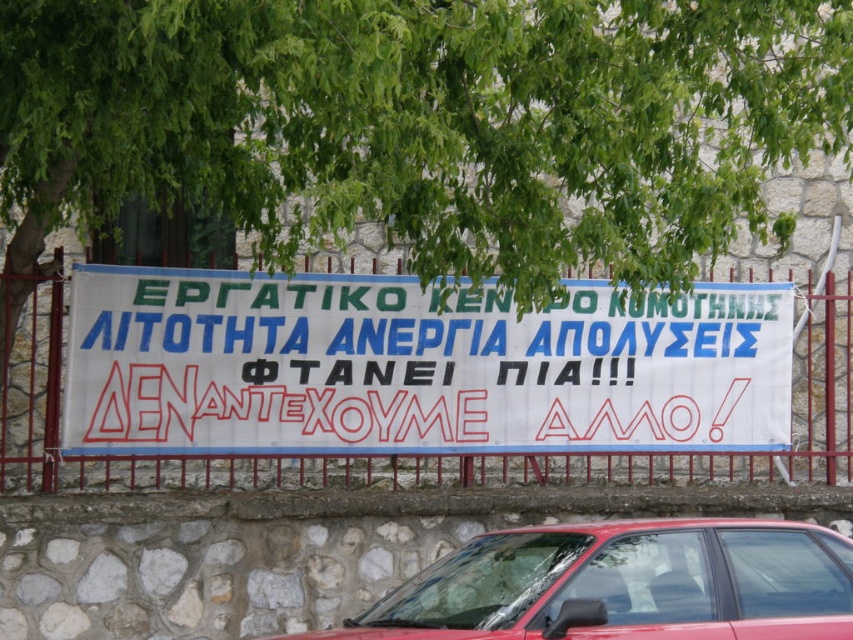
Is white paper banner at center above shiny red car at center?

Yes.

Is white paper banner at center to the right of shiny red car at center from the viewer's perspective?

In fact, white paper banner at center is to the left of shiny red car at center.

Between point (219, 451) and point (817, 579), which one is positioned behind?

Point (219, 451)

The height and width of the screenshot is (640, 853). What are the coordinates of `white paper banner at center` in the screenshot? It's located at (415, 368).